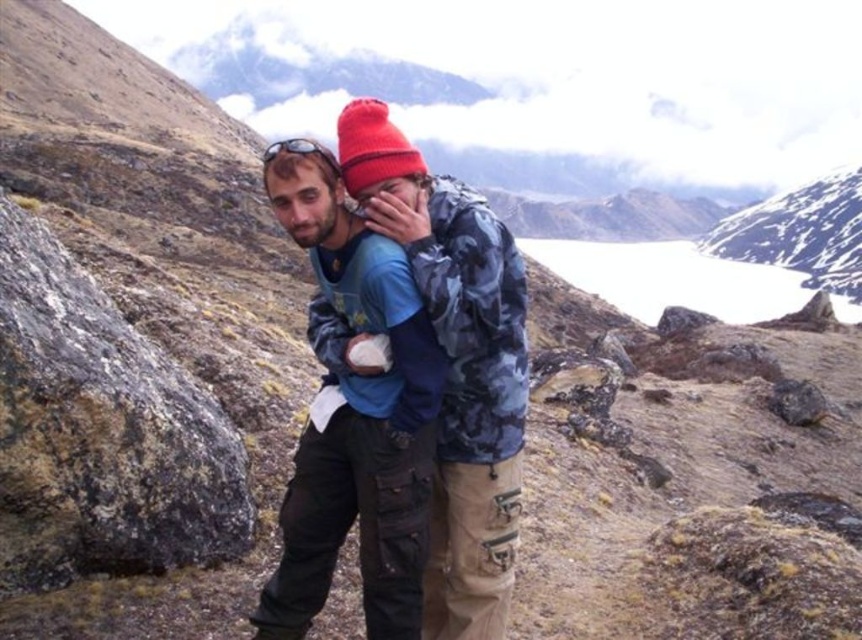
You are planning to take a photo of the matte blue shirt at center and the snowy white mountain at upper center. If you want to ensure both are fully visible in the frame, which object should you adjust your camera focus towards to avoid cropping either?

The matte blue shirt at center is narrower than the snowy white mountain at upper center. To ensure both are fully visible, focus on the wider snowy white mountain at upper center as it requires more space in the frame.

You are planning a hiking route and need to know the distance between the matte blue shirt at center and the snowy white mountain at upper center. Can you confirm if the distance is over 700 meters?

The matte blue shirt at center and snowy white mountain at upper center are 764.98 meters apart, so yes, the distance is over 700 meters.

You are planning a hiking route and need to decide between two landmarks in the image. The rocky gray at left and the snowy white mountain at upper center. Which one is closer to you based on their sizes in the image?

The rocky gray at left is smaller in size compared to the snowy white mountain at upper center, so the snowy white mountain at upper center is closer to you because larger objects in the distance appear smaller, but since the rocky gray is smaller, it might actually be farther away. Wait, this is confusing. Let me think again. If the rocky gray is smaller in the image but actually closer, that would mean it is a smaller object. However, the snowy mountain is larger in the image, so if it were farther, it is